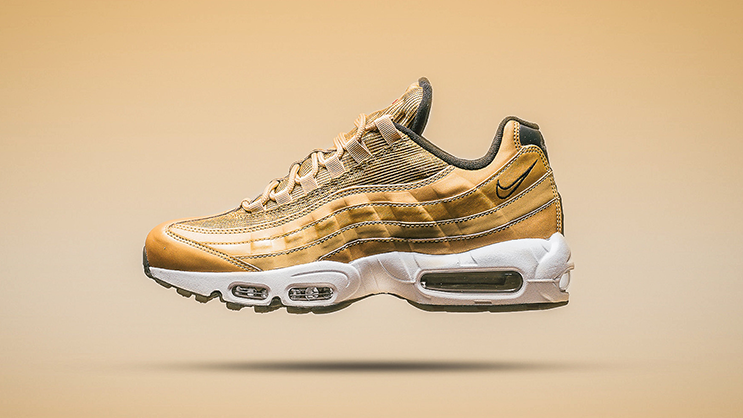
This screenshot has height=418, width=743. Identify the location of lights. (293, 296).